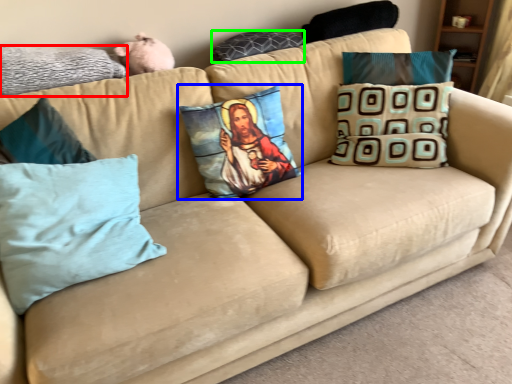
Question: Considering the real-world distances, which object is closest to pillow (highlighted by a red box)? pillow (highlighted by a blue box) or pillow (highlighted by a green box).

Choices:
 (A) pillow
 (B) pillow

Answer: (A)